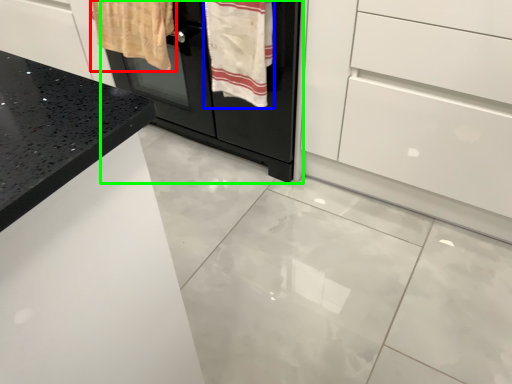
Question: Which is nearer to the bath towel (highlighted by a red box)? bath towel (highlighted by a blue box) or oven (highlighted by a green box).

Choices:
 (A) bath towel
 (B) oven

Answer: (B)